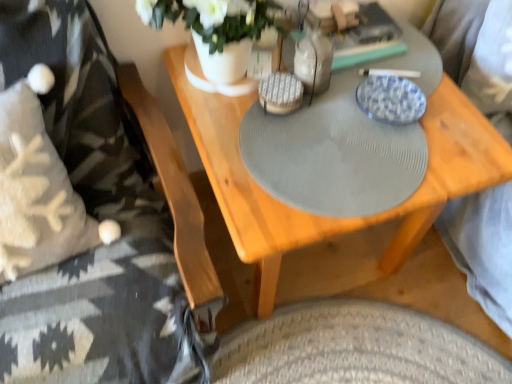
Where is `spots to the right of white matte vase at upper center`? Image resolution: width=512 pixels, height=384 pixels. spots to the right of white matte vase at upper center is located at coordinates (344, 115).